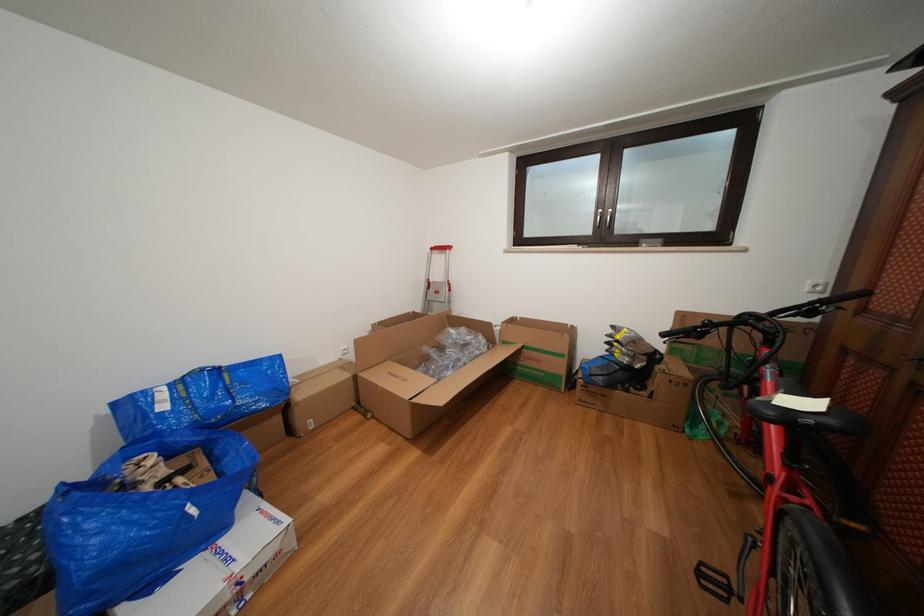
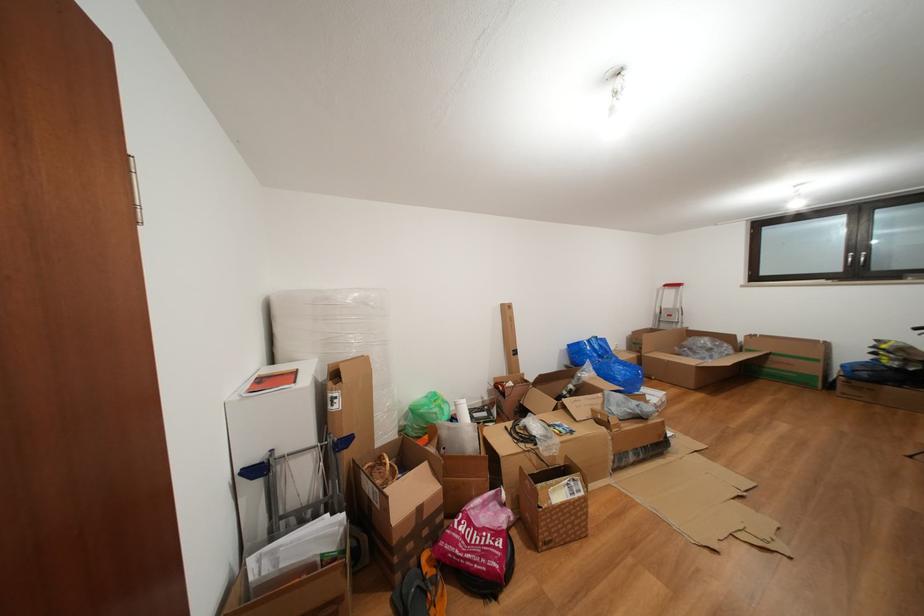
In the second image, find the point that corresponds to point (570, 361) in the first image.

(824, 366)